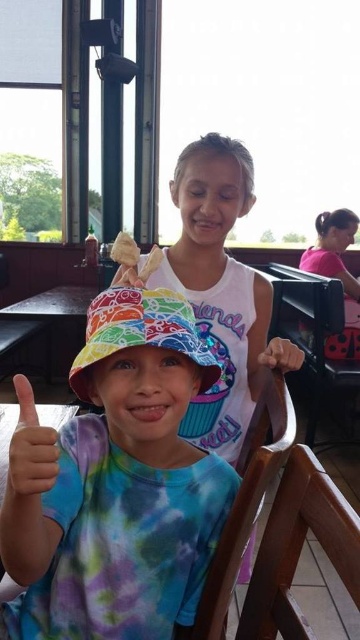
You are a person who is 6 feet tall and standing in the scene. There is a brown wooden chair at lower right. Can you sit on it without moving your current position?

The brown wooden chair at lower right is 16.27 inches away from you. Since you are 6 feet tall, you can comfortably sit on it without needing to move your current position as the distance is sufficient.

Based on the photo, you are a photographer trying to capture the perfect shot of the two children at the table. You notice two points of interest marked at coordinates point (146,298) and point (284,272). Which point should you focus on first if you want to ensure the closest subject is in sharp focus?

Point (146,298) is closer to the viewer than point (284,272), so you should focus on point (146,298) first to ensure the closest subject is in sharp focus.